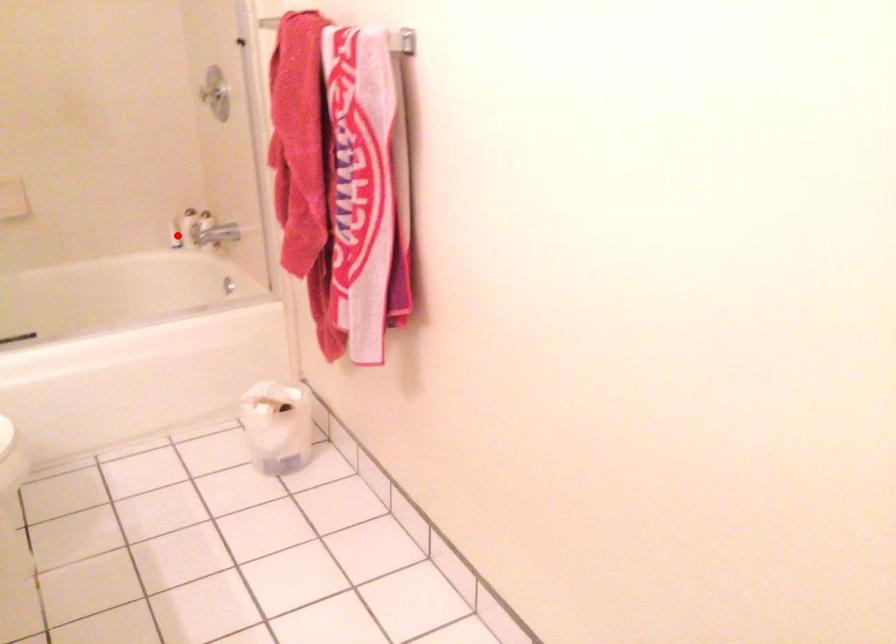
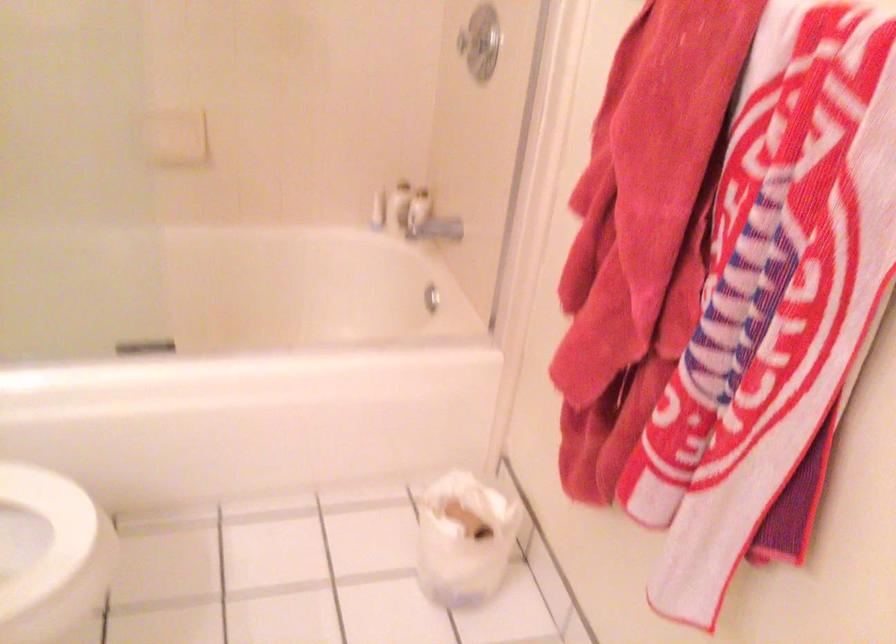
In the second image, find the point that corresponds to the highlighted location in the first image.

(378, 211)